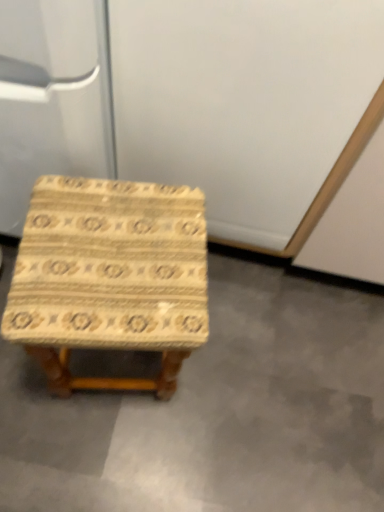
In order to face wooden-patterned stool at center, should I rotate leftwards or rightwards?

A 9.907 degree turn to the left will do.

In order to click on wooden-patterned stool at center in this screenshot , I will do [110, 277].

What do you see at coordinates (110, 277) in the screenshot?
I see `wooden-patterned stool at center` at bounding box center [110, 277].

What do you see at coordinates (217, 412) in the screenshot? I see `beige textured stool at center` at bounding box center [217, 412].

In order to face beige textured stool at center, should I rotate leftwards or rightwards?

To face it directly, rotate left by 1.933 degrees.

What are the coordinates of `beige textured stool at center` in the screenshot? It's located at (217, 412).

The image size is (384, 512). I want to click on wooden-patterned stool at center, so click(x=110, y=277).

Does wooden-patterned stool at center appear on the right side of beige textured stool at center?

No.

Does wooden-patterned stool at center come behind beige textured stool at center?

No, it is not.

Considering the points (142, 276) and (128, 494), which point is in front, point (142, 276) or point (128, 494)?

Positioned in front is point (142, 276).

From the image's perspective, which is below, wooden-patterned stool at center or beige textured stool at center?

beige textured stool at center appears lower in the image.

From a real-world perspective, is wooden-patterned stool at center above or below beige textured stool at center?

wooden-patterned stool at center is above beige textured stool at center.

Considering the sizes of objects wooden-patterned stool at center and beige textured stool at center in the image provided, who is thinner, wooden-patterned stool at center or beige textured stool at center?

With smaller width is wooden-patterned stool at center.

Between wooden-patterned stool at center and beige textured stool at center, which one has less height?

beige textured stool at center is shorter.

Which of these two, wooden-patterned stool at center or beige textured stool at center, is bigger?

With larger size is wooden-patterned stool at center.

Is wooden-patterned stool at center not within beige textured stool at center?

Yes, wooden-patterned stool at center is not within beige textured stool at center.

Is wooden-patterned stool at center not near beige textured stool at center?

No, wooden-patterned stool at center is not far from beige textured stool at center.

Is wooden-patterned stool at center oriented away from beige textured stool at center?

wooden-patterned stool at center does not have its back to beige textured stool at center.

How different are the orientations of wooden-patterned stool at center and beige textured stool at center in degrees?

They differ by 99.9 degrees in their facing directions.

Identify the location of concrete that is below the wooden-patterned stool at center (from the image's perspective). (217, 412).

In the image, is beige textured stool at center on the left side or the right side of wooden-patterned stool at center?

In the image, beige textured stool at center appears on the right side of wooden-patterned stool at center.

In the scene shown: Which is behind, beige textured stool at center or wooden-patterned stool at center?

beige textured stool at center is further from the camera.

Which is more distant, (343, 409) or (190, 229)?

The point (343, 409) is farther.

From the image's perspective, does beige textured stool at center appear lower than wooden-patterned stool at center?

Indeed, from the image's perspective, beige textured stool at center is shown beneath wooden-patterned stool at center.

From a real-world perspective, is beige textured stool at center beneath wooden-patterned stool at center?

Yes.

Considering the relative sizes of beige textured stool at center and wooden-patterned stool at center in the image provided, is beige textured stool at center thinner than wooden-patterned stool at center?

No.

Who is shorter, beige textured stool at center or wooden-patterned stool at center?

beige textured stool at center is shorter.

Does beige textured stool at center have a smaller size compared to wooden-patterned stool at center?

Yes.

Is wooden-patterned stool at center completely or partially inside beige textured stool at center?

That's incorrect, wooden-patterned stool at center is not inside beige textured stool at center.

Are beige textured stool at center and wooden-patterned stool at center far apart?

No, beige textured stool at center is not far away from wooden-patterned stool at center.

Is beige textured stool at center oriented away from wooden-patterned stool at center?

No.

How different are the orientations of beige textured stool at center and wooden-patterned stool at center in degrees?

There is a 99.9-degree angle between the facing directions of beige textured stool at center and wooden-patterned stool at center.

Measure the distance from beige textured stool at center to wooden-patterned stool at center.

beige textured stool at center is 32.88 centimeters away from wooden-patterned stool at center.

This screenshot has width=384, height=512. I want to click on stool above the beige textured stool at center (from a real-world perspective), so click(110, 277).

At what (x,y) coordinates should I click in order to perform the action: click on concrete below the wooden-patterned stool at center (from a real-world perspective). Please return your answer as a coordinate pair (x, y). The width and height of the screenshot is (384, 512). Looking at the image, I should click on [x=217, y=412].

This screenshot has width=384, height=512. In order to click on concrete located on the right of wooden-patterned stool at center in this screenshot , I will do `click(217, 412)`.